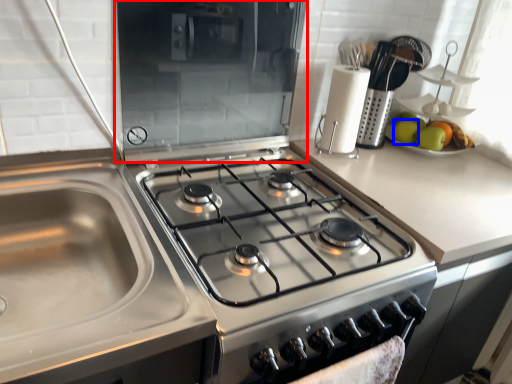
Question: Among these objects, which one is farthest to the camera, appliance (highlighted by a red box) or apple (highlighted by a blue box)?

Choices:
 (A) appliance
 (B) apple

Answer: (B)